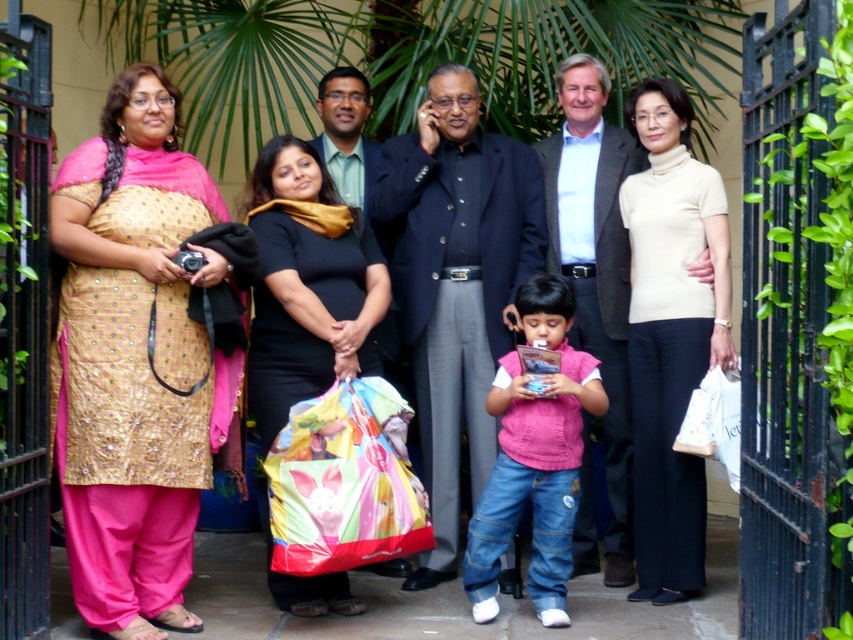
Question: Which of the following is the closest to the observer?

Choices:
 (A) (109, 465)
 (B) (107, 355)
 (C) (296, 376)

Answer: (A)

Question: Among these points, which one is nearest to the camera?

Choices:
 (A) (350, 339)
 (B) (596, 145)
 (C) (363, 426)
 (D) (351, 256)

Answer: (C)

Question: Which point is closer to the camera?

Choices:
 (A) (303, 486)
 (B) (141, 484)
 (C) (656, 136)
 (D) (198, 625)

Answer: (B)

Question: Does beige turtleneck sweater at center have a larger size compared to green textured shirt at center?

Choices:
 (A) no
 (B) yes

Answer: (B)

Question: Does dark blue suit at center come behind pink knitted vest at center?

Choices:
 (A) yes
 (B) no

Answer: (A)

Question: Is dark blue suit at center further to camera compared to green textured shirt at center?

Choices:
 (A) no
 (B) yes

Answer: (A)